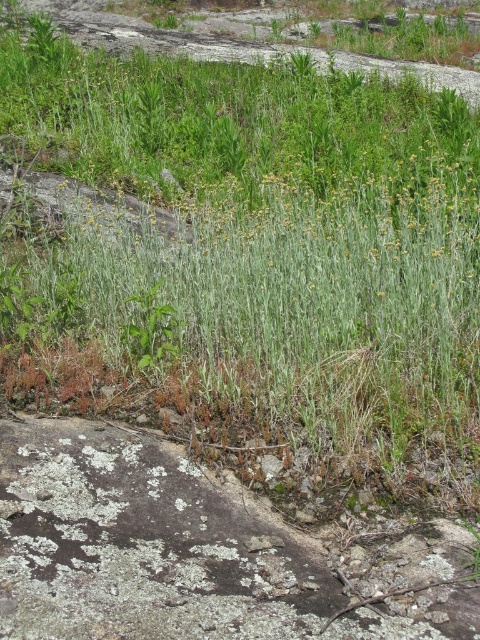
You are standing in the rocky landscape and want to step on the green grass at center and the green leafy plant at center. Which one can you step on without bending down?

The green grass at center is closer to the viewer than the green leafy plant at center, so you can step on the green grass at center without bending down because it is at a lower height.

You are a photographer standing in the rocky landscape. You want to take a photo of the point at coordinates point (384,342) and point (132,323). Which point will appear larger in your photo?

Point (384,342) is closer to the camera than point (132,323), so it will appear larger in the photo.